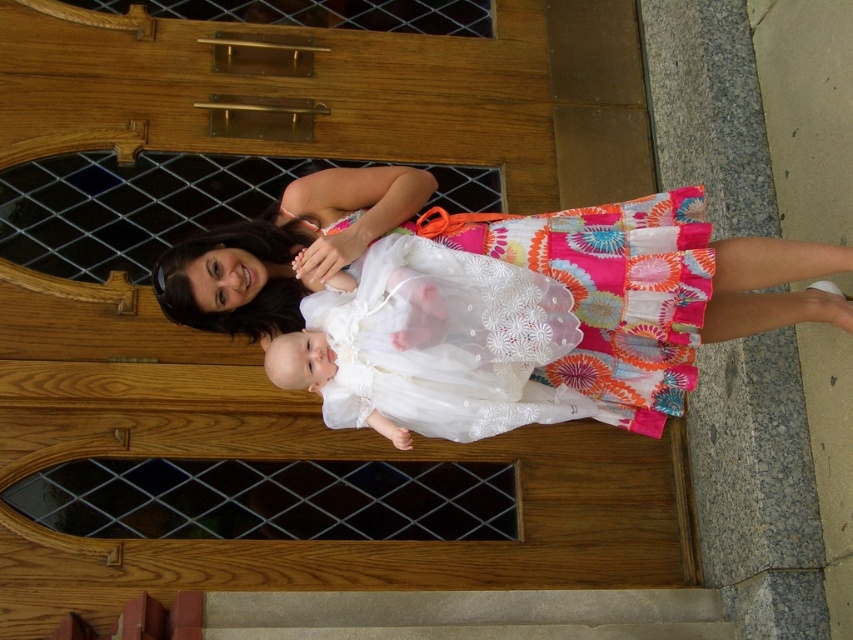
In the scene shown: You are an artist trying to sketch the scene described. You want to place the white lace dress at center in your drawing. Where should you position it on your 2D canvas if the canvas coordinates are from 0 to 1 in both x and y axes?

You should position the white lace dress at center at the coordinates approximately at point (610,291) on your 2D canvas.

You are a photographer planning to take a photo of the white lace dress at center and the smooth concrete stair at lower center. Which object should you focus on first if you want to capture both in a single shot without moving the camera?

The white lace dress at center is not as tall as the smooth concrete stair at lower center, so you should focus on the smooth concrete stair at lower center first to ensure both are in frame.

You are a photographer setting up a shot of the woman and the baby. You need to ensure the white lace dress at center and the smooth concrete stair at lower center are both in frame. Which object should be placed to the left to ensure both are visible?

The smooth concrete stair at lower center should be placed to the left because the white lace dress at center is positioned on the right side of it, so placing the stair on the left would allow the dress to be on the right side of the stair and both objects to be in the frame.